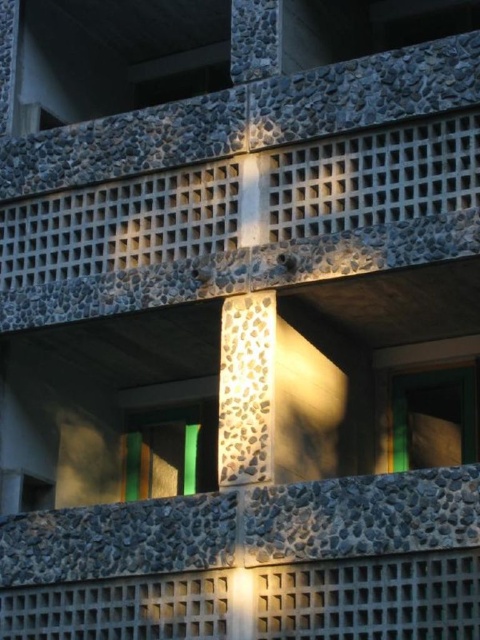
You are standing in front of the architectural structure and notice two points marked on the facade. The first point is at coordinate point (414, 461) and the second is at point (123, 448). Which point is closer to your view?

Point (414, 461) is closer to the viewer than point (123, 448).